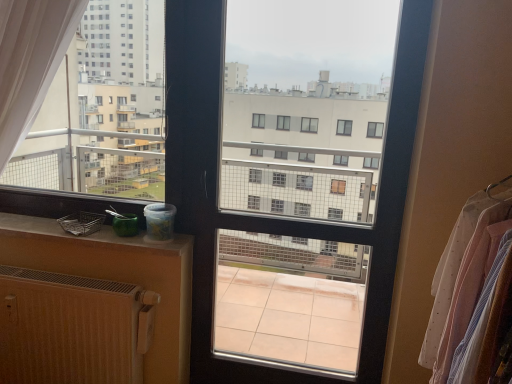
Locate an element on the screen. The height and width of the screenshot is (384, 512). free point below white matte plastic container at left (from a real-world perspective) is located at coordinates (51, 216).